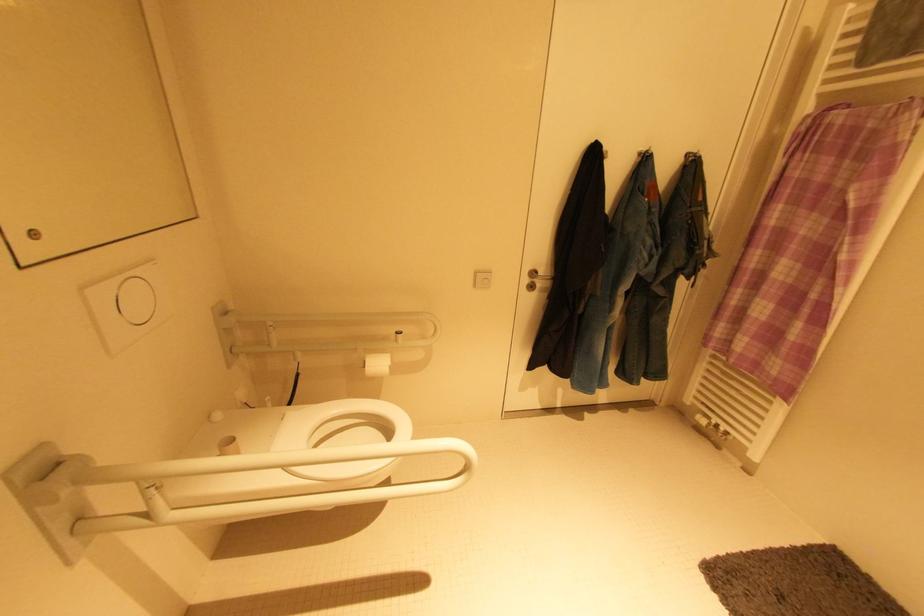
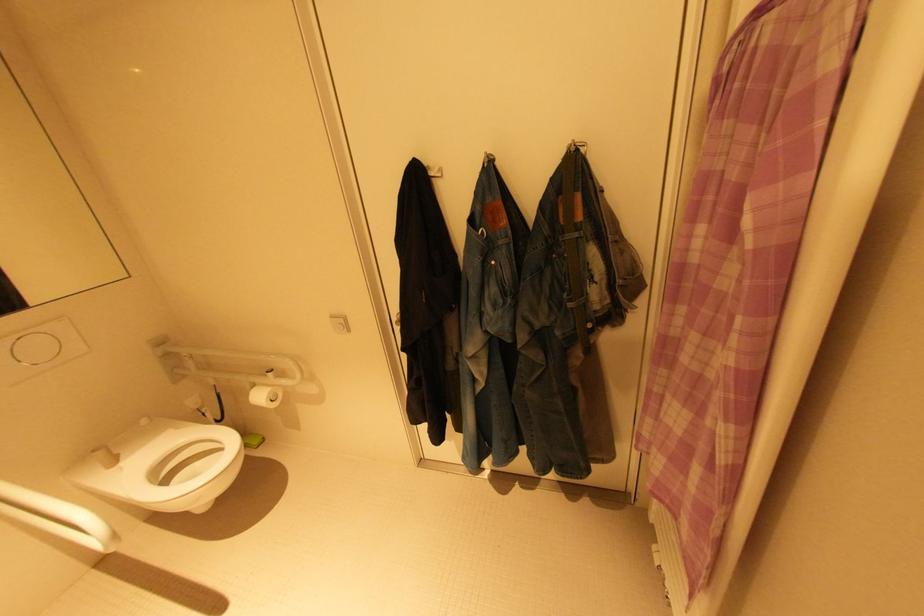
The images are taken continuously from a first-person perspective. In which direction are you moving?

The movement direction of the cameraman is right, forward.